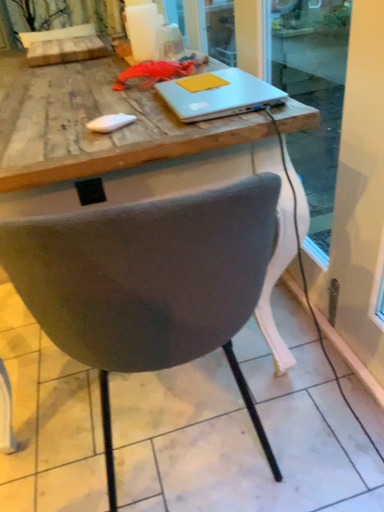
Locate an element on the screen. The image size is (384, 512). vacant point to the right of gray fabric chair at center is located at coordinates (308, 394).